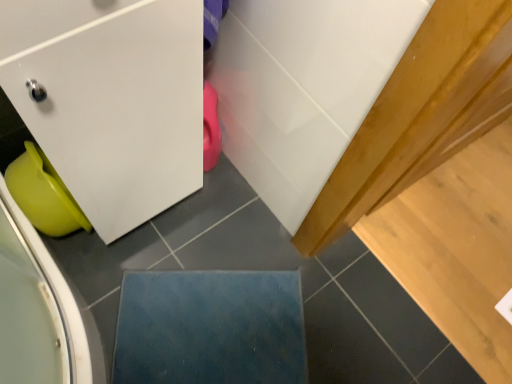
Question: Considering the relative sizes of matte green plastic toilet bowl at lower left and blue felt mat at lower center in the image provided, is matte green plastic toilet bowl at lower left shorter than blue felt mat at lower center?

Choices:
 (A) yes
 (B) no

Answer: (B)

Question: Is matte green plastic toilet bowl at lower left bigger than blue felt mat at lower center?

Choices:
 (A) no
 (B) yes

Answer: (B)

Question: Can you confirm if matte green plastic toilet bowl at lower left is smaller than blue felt mat at lower center?

Choices:
 (A) yes
 (B) no

Answer: (B)

Question: Is matte green plastic toilet bowl at lower left to the left of blue felt mat at lower center from the viewer's perspective?

Choices:
 (A) yes
 (B) no

Answer: (A)

Question: Is matte green plastic toilet bowl at lower left further to the viewer compared to blue felt mat at lower center?

Choices:
 (A) yes
 (B) no

Answer: (B)

Question: Can we say matte green plastic toilet bowl at lower left lies outside blue felt mat at lower center?

Choices:
 (A) no
 (B) yes

Answer: (B)

Question: Is blue felt mat at lower center to the right of matte green plastic toilet bowl at lower left from the viewer's perspective?

Choices:
 (A) yes
 (B) no

Answer: (A)

Question: Can you confirm if blue felt mat at lower center is smaller than matte green plastic toilet bowl at lower left?

Choices:
 (A) yes
 (B) no

Answer: (A)

Question: Are blue felt mat at lower center and matte green plastic toilet bowl at lower left located far from each other?

Choices:
 (A) yes
 (B) no

Answer: (B)

Question: Is blue felt mat at lower center oriented away from matte green plastic toilet bowl at lower left?

Choices:
 (A) no
 (B) yes

Answer: (A)

Question: Is the depth of blue felt mat at lower center less than that of matte green plastic toilet bowl at lower left?

Choices:
 (A) no
 (B) yes

Answer: (A)

Question: Does blue felt mat at lower center touch matte green plastic toilet bowl at lower left?

Choices:
 (A) yes
 (B) no

Answer: (B)

Question: Is point (72, 225) closer or farther from the camera than point (231, 304)?

Choices:
 (A) farther
 (B) closer

Answer: (B)